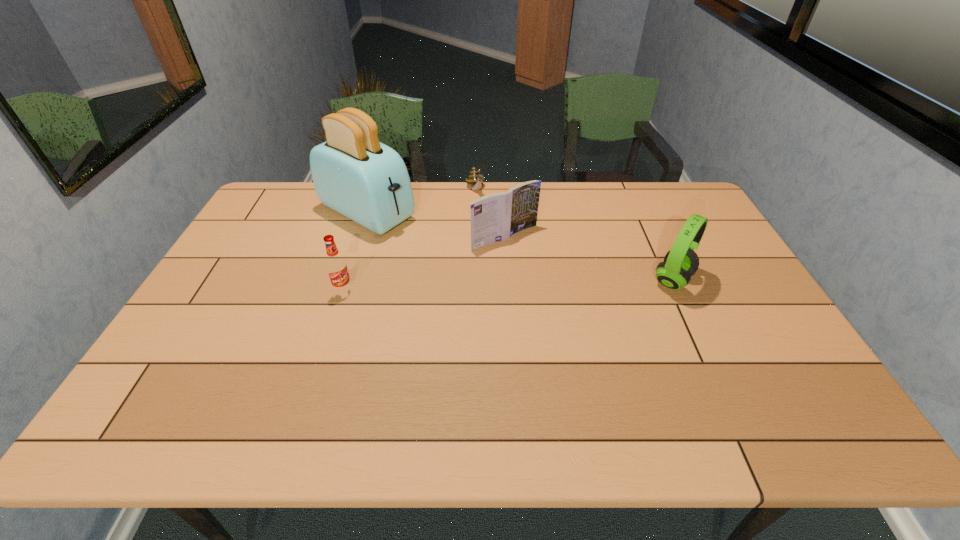
Locate an element on the screen. The width and height of the screenshot is (960, 540). root beer is located at coordinates (336, 266).

Image resolution: width=960 pixels, height=540 pixels. I want to click on the rightmost object, so click(x=680, y=263).

You are a GUI agent. You are given a task and a screenshot of the screen. Output one action in this format:
    pyautogui.click(x=<x>, y=<y>)
    Task: Click on the snail
    The image size is (960, 540).
    Given the screenshot: What is the action you would take?
    pyautogui.click(x=474, y=178)

Locate an element on the screen. The width and height of the screenshot is (960, 540). toaster is located at coordinates (353, 173).

You are a GUI agent. You are given a task and a screenshot of the screen. Output one action in this format:
    pyautogui.click(x=<x>, y=<y>)
    Task: Click on the book
    
    Given the screenshot: What is the action you would take?
    pyautogui.click(x=495, y=217)

The height and width of the screenshot is (540, 960). What are the coordinates of `vacant region located 0.390m on the back of the root beer` in the screenshot? It's located at (370, 207).

Where is `free space located on the front of the rightmost object`? free space located on the front of the rightmost object is located at coordinates (710, 361).

The width and height of the screenshot is (960, 540). Identify the location of free space located on the face of the shortest object. (501, 241).

Find the location of a particular element. The width and height of the screenshot is (960, 540). vacant space located 0.380m on the face of the shortest object is located at coordinates (514, 265).

Image resolution: width=960 pixels, height=540 pixels. In order to click on vacant space located 0.080m on the face of the shortest object in this screenshot , I will do `click(485, 211)`.